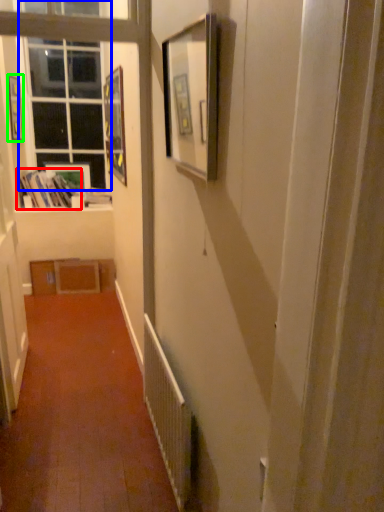
Question: Which is nearer to the book (highlighted by a red box)? window (highlighted by a blue box) or picture frame (highlighted by a green box).

Choices:
 (A) window
 (B) picture frame

Answer: (A)